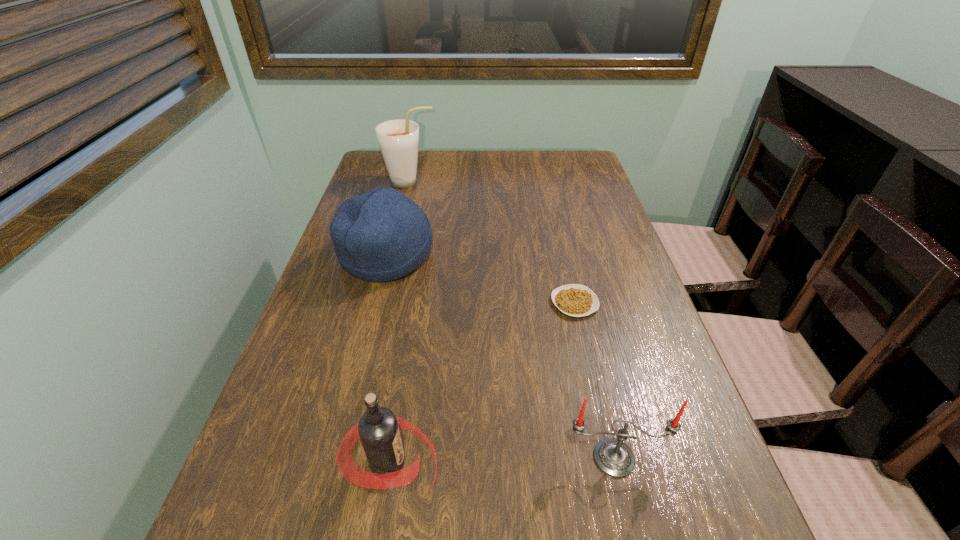
At what (x,y) coordinates should I click in order to perform the action: click on free space located on the back of the legume. Please return your answer as a coordinate pair (x, y). The width and height of the screenshot is (960, 540). Looking at the image, I should click on (557, 226).

I want to click on object located in the far edge section of the desktop, so click(398, 139).

Locate an element on the screen. The height and width of the screenshot is (540, 960). skullcap at the left edge is located at coordinates (381, 235).

You are a GUI agent. You are given a task and a screenshot of the screen. Output one action in this format:
    pyautogui.click(x=<x>, y=<y>)
    Task: Click on the candle present at the right edge
    This screenshot has width=960, height=540.
    Given the screenshot: What is the action you would take?
    pyautogui.click(x=613, y=457)

The height and width of the screenshot is (540, 960). I want to click on legume at the right edge, so click(576, 300).

Where is `object that is at the far left corner`? The height and width of the screenshot is (540, 960). object that is at the far left corner is located at coordinates (398, 139).

Locate an element on the screen. This screenshot has height=540, width=960. vacant region at the far edge is located at coordinates (492, 153).

The image size is (960, 540). In order to click on vacant space at the left edge of the desktop in this screenshot , I will do `click(363, 300)`.

Identify the location of vacant space at the right edge of the desktop. Image resolution: width=960 pixels, height=540 pixels. point(599,349).

Where is `free space at the far right corner`? This screenshot has width=960, height=540. free space at the far right corner is located at coordinates (551, 176).